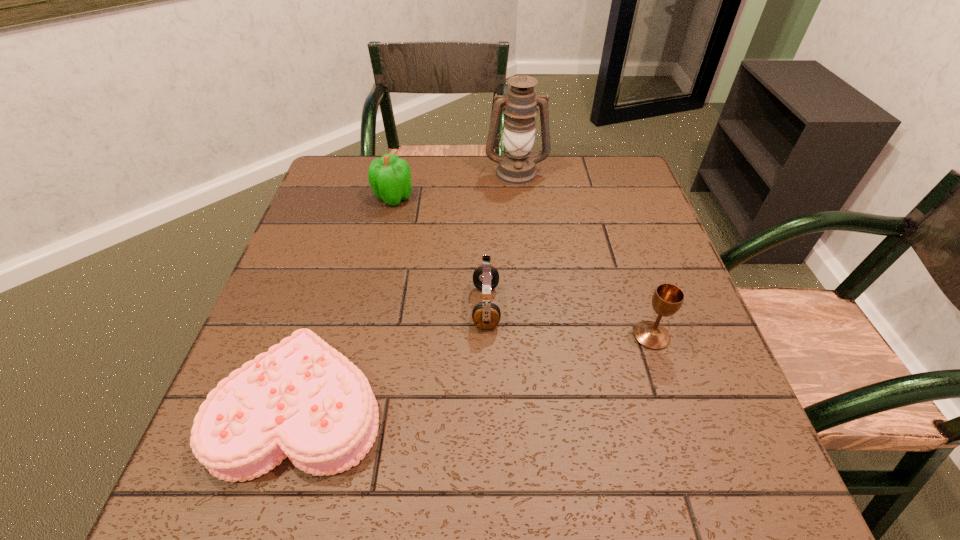
Image resolution: width=960 pixels, height=540 pixels. I want to click on object that is at the near left corner, so click(x=303, y=399).

This screenshot has width=960, height=540. I want to click on vacant space at the far edge of the desktop, so click(434, 163).

Identify the location of free spot at the near edge of the desktop. This screenshot has width=960, height=540. (585, 476).

Locate an element on the screen. This screenshot has width=960, height=540. vacant region at the left edge of the desktop is located at coordinates (328, 249).

In the image, there is a desktop. Identify the location of vacant space at the right edge. Image resolution: width=960 pixels, height=540 pixels. (675, 284).

The image size is (960, 540). Identify the location of vacant space at the far left corner. (333, 171).

This screenshot has width=960, height=540. What are the coordinates of `free region at the far right corner of the desktop` in the screenshot? It's located at (633, 174).

You are a GUI agent. You are given a task and a screenshot of the screen. Output one action in this format:
    pyautogui.click(x=<x>, y=<y>)
    Task: Click on the free point between the headset and the tallest object
    The width and height of the screenshot is (960, 540).
    Given the screenshot: What is the action you would take?
    pyautogui.click(x=501, y=240)

The width and height of the screenshot is (960, 540). I want to click on vacant region between the rightmost object and the fourth nearest object, so click(x=522, y=267).

Locate an element on the screen. The image size is (960, 540). free spot between the cake and the headset is located at coordinates (395, 356).